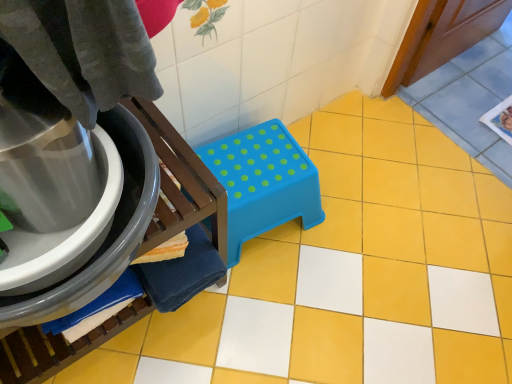
Question: Considering the positions of point (292, 173) and point (98, 276), is point (292, 173) closer or farther from the camera than point (98, 276)?

Choices:
 (A) farther
 (B) closer

Answer: (A)

Question: Is blue plastic step stool at center inside or outside of blue plastic stool at center?

Choices:
 (A) inside
 (B) outside

Answer: (B)

Question: From the image's perspective, relative to blue plastic stool at center, is blue plastic step stool at center above or below?

Choices:
 (A) above
 (B) below

Answer: (A)

Question: From a real-world perspective, is blue plastic stool at center above or below blue plastic step stool at center?

Choices:
 (A) above
 (B) below

Answer: (A)

Question: Based on their sizes in the image, would you say blue plastic stool at center is bigger or smaller than blue plastic step stool at center?

Choices:
 (A) big
 (B) small

Answer: (A)

Question: Is blue plastic stool at center to the left or to the right of blue plastic step stool at center in the image?

Choices:
 (A) right
 (B) left

Answer: (B)

Question: Is blue plastic stool at center in front of or behind blue plastic step stool at center in the image?

Choices:
 (A) behind
 (B) front

Answer: (B)